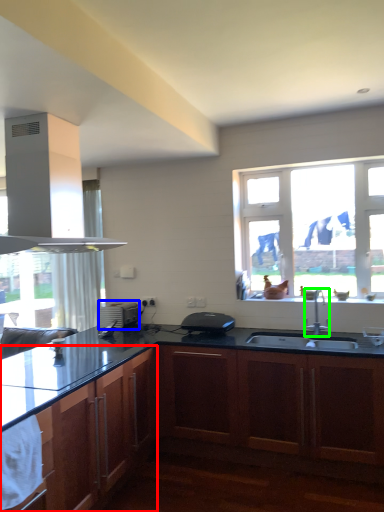
Question: Which is nearer to the cabinetry (highlighted by a red box)? appliance (highlighted by a blue box) or faucet (highlighted by a green box).

Choices:
 (A) appliance
 (B) faucet

Answer: (A)